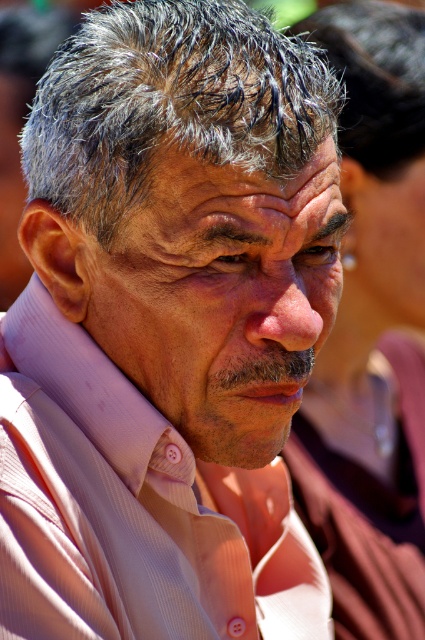
You are a photographer analyzing this portrait. You notice the gray matte hair at center and the dark brown curly hair at upper center. Which hair is located to the left of the other?

The gray matte hair at center is positioned on the left side of dark brown curly hair at upper center.

You are a photographer standing 5 feet away from the subject. You want to take a portrait where the matte pink shirt at center is in focus. If your camera has a depth of field that can sharply focus objects within 4 feet, will the shirt be in focus?

The matte pink shirt at center is 4.41 feet away from the camera. Since the photographer is standing 5 feet away and the depth of field focuses within 4 feet, the shirt is slightly beyond the 4 feet range. Therefore, it might not be in focus.